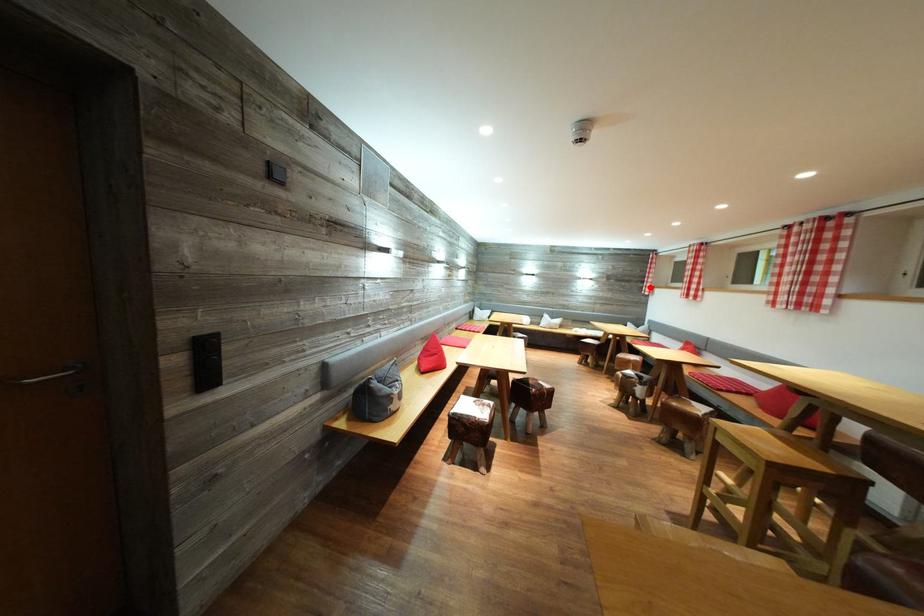
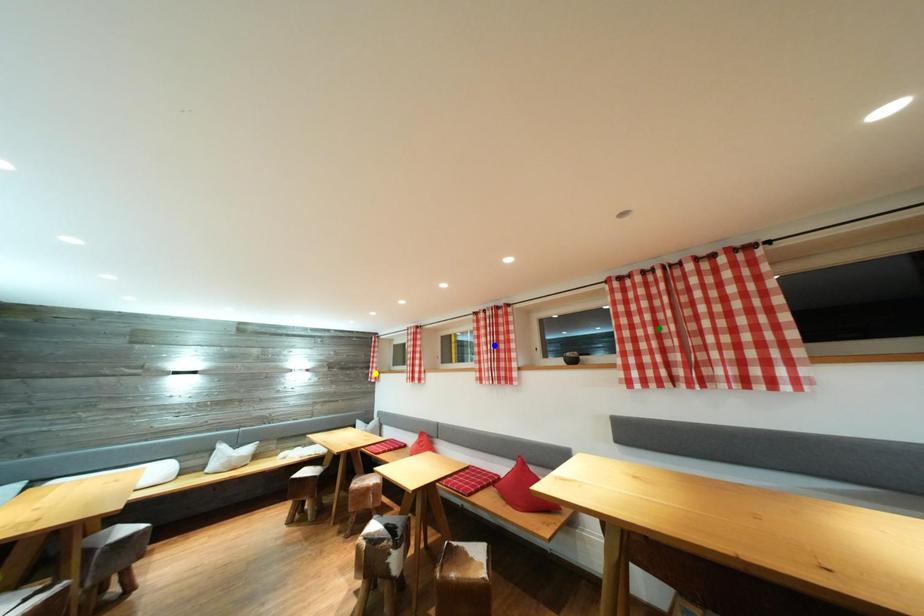
Question: I am providing you with two images of the same scene from different viewpoints. A red point is marked on the first image. You are given multiple points on the second image. In image 2, which mark is for the same physical point as the one in image 1?

Choices:
 (A) yellow point
 (B) blue point
 (C) green point

Answer: (A)